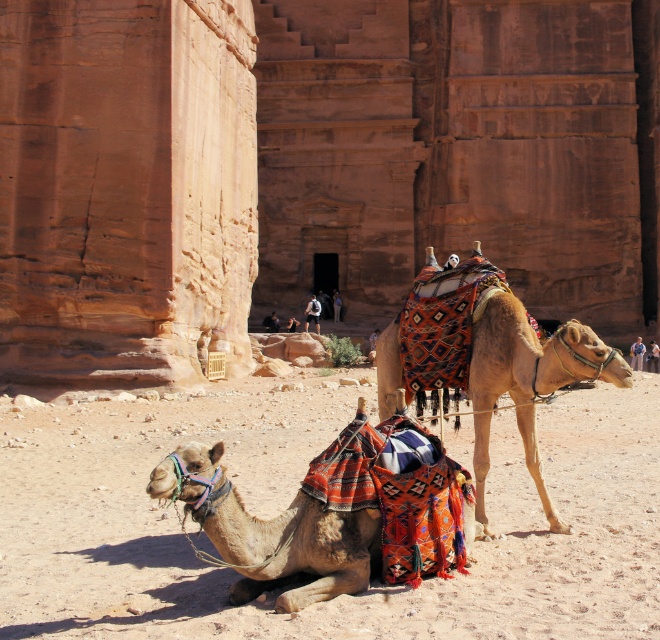
Question: Can you confirm if multicolored fabric camel at lower left is thinner than multicolored woven saddle at center?

Choices:
 (A) no
 (B) yes

Answer: (B)

Question: Among these points, which one is nearest to the camera?

Choices:
 (A) (383, 337)
 (B) (378, 525)

Answer: (B)

Question: Is sandy beige sand at lower center in front of multicolored fabric camel at lower left?

Choices:
 (A) yes
 (B) no

Answer: (A)

Question: Which object is the closest to the sandy beige sand at lower center?

Choices:
 (A) multicolored fabric camel at lower left
 (B) multicolored woven saddle at center

Answer: (A)

Question: Which of the following is the closest to the observer?

Choices:
 (A) multicolored fabric camel at lower left
 (B) sandy beige sand at lower center

Answer: (B)

Question: Can you confirm if multicolored fabric camel at lower left is positioned above multicolored woven saddle at center?

Choices:
 (A) no
 (B) yes

Answer: (A)